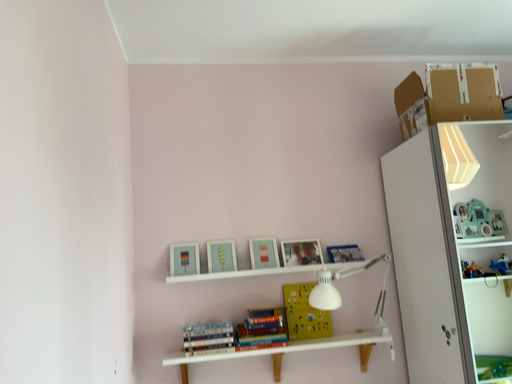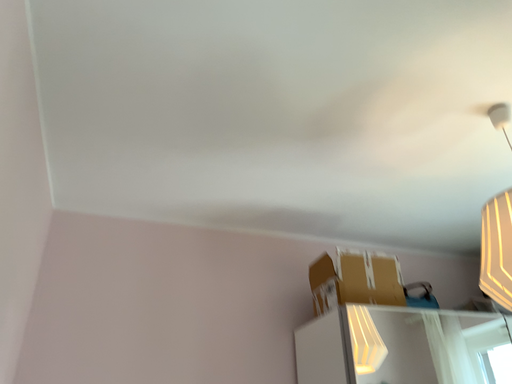
Question: How did the camera likely rotate when shooting the video?

Choices:
 (A) rotated upward
 (B) rotated downward

Answer: (A)